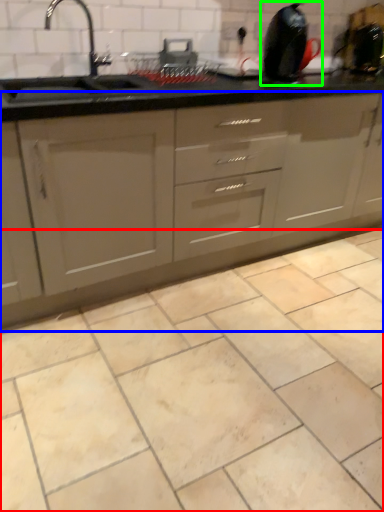
Question: Based on their relative distances, which object is nearer to ceramic tile (highlighted by a red box)? Choose from cabinetry (highlighted by a blue box) and appliance (highlighted by a green box).

Choices:
 (A) cabinetry
 (B) appliance

Answer: (A)